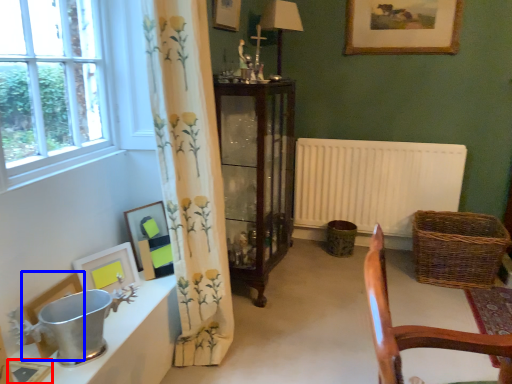
Question: Which object is closer to the camera taking this photo, picture frame (highlighted by a red box) or picture frame (highlighted by a blue box)?

Choices:
 (A) picture frame
 (B) picture frame

Answer: (A)